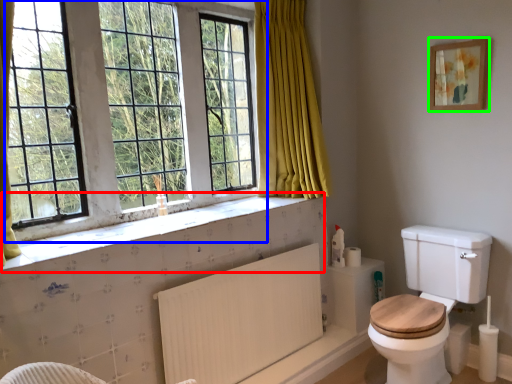
Question: Considering the real-world distances, which object is closest to window sill (highlighted by a red box)? window (highlighted by a blue box) or picture frame (highlighted by a green box).

Choices:
 (A) window
 (B) picture frame

Answer: (A)